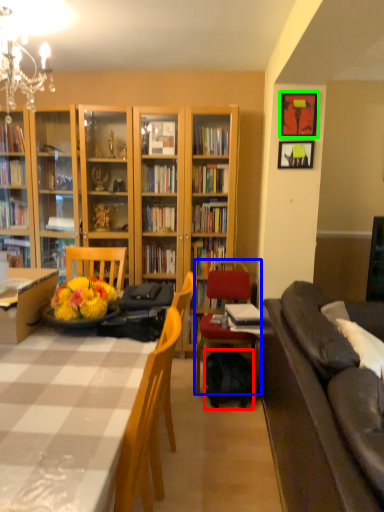
Question: Which is nearer to the backpack (highlighted by a red box)? chair (highlighted by a blue box) or picture frame (highlighted by a green box).

Choices:
 (A) chair
 (B) picture frame

Answer: (A)